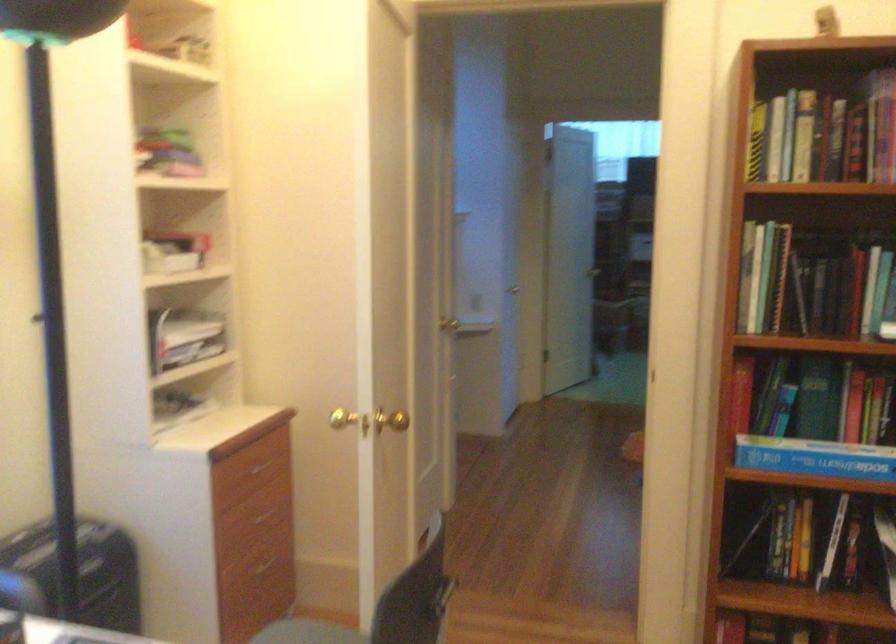
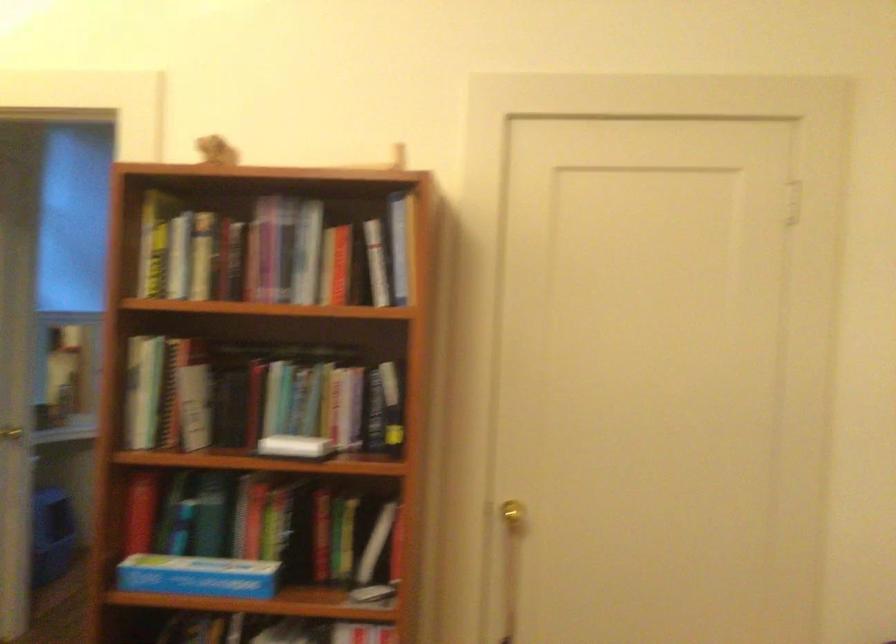
In the second image, find the point that corresponds to the point at 817,456 in the first image.

(197, 576)